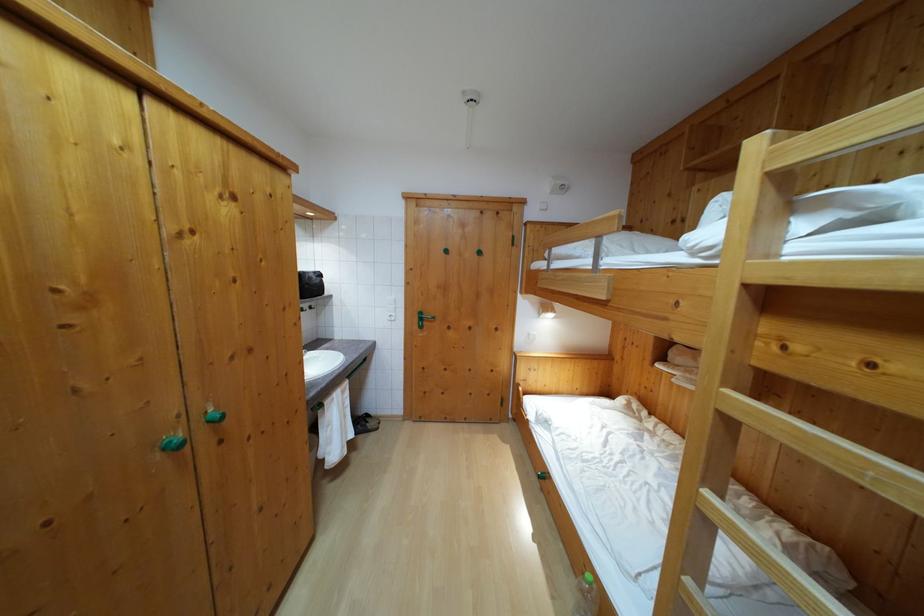
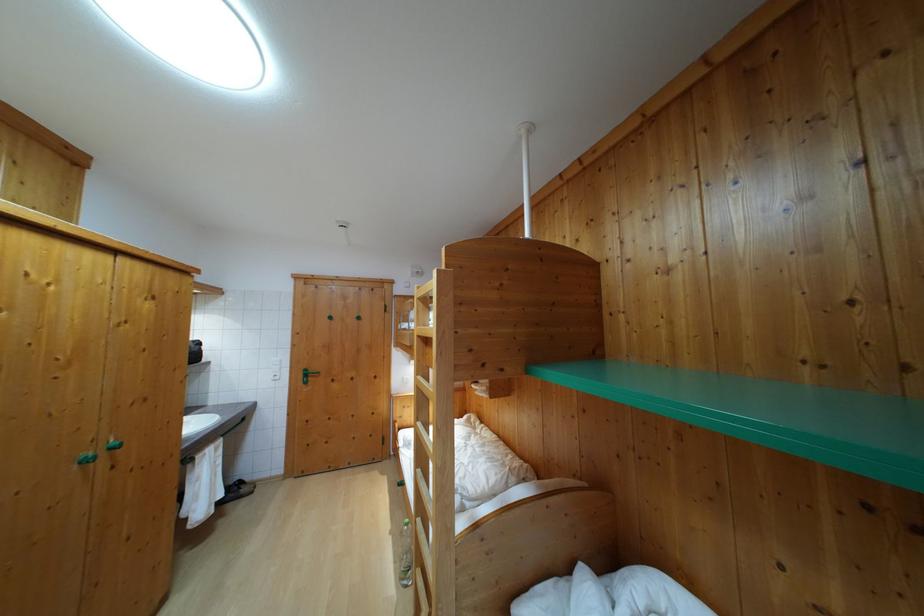
In the second image, find the point that corresponds to [749,294] in the first image.

(421, 342)